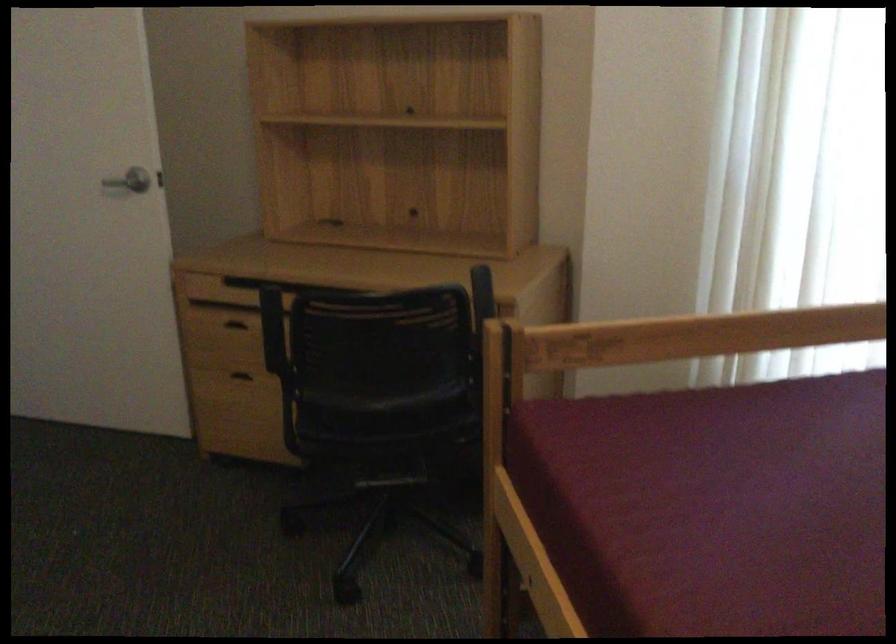
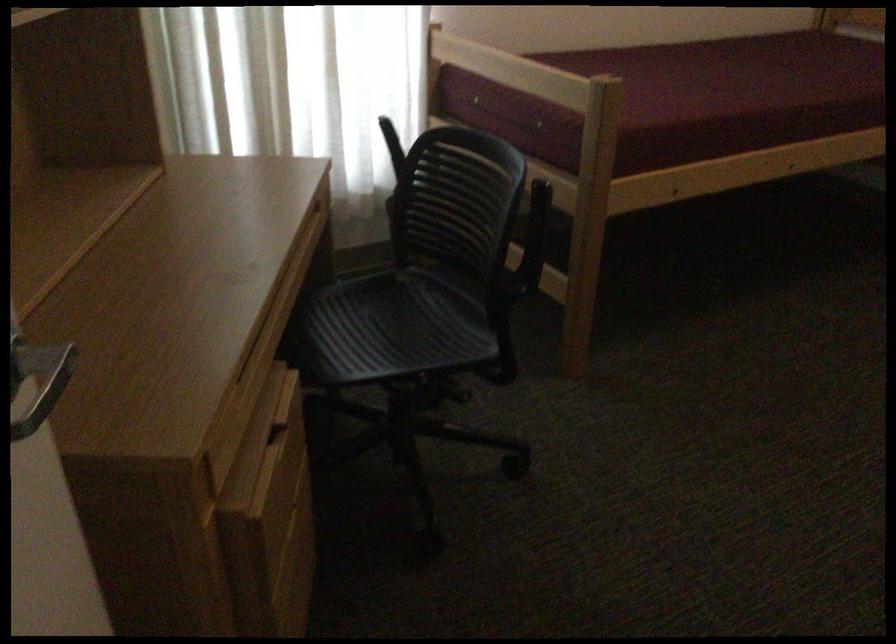
Locate, in the second image, the point that corresponds to (273,243) in the first image.

(55, 380)